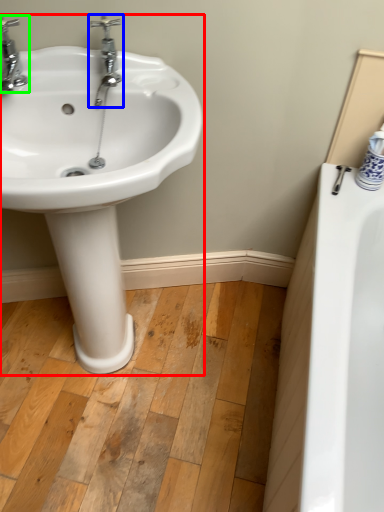
Question: Which is farther away from sink (highlighted by a red box)? tap (highlighted by a blue box) or tap (highlighted by a green box)?

Choices:
 (A) tap
 (B) tap

Answer: (B)